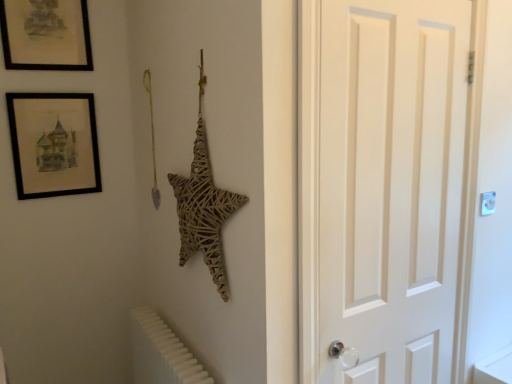
Question: Is black matte picture frame at upper left, placed as the second picture frame when sorted from top to bottom, facing away from white plastic light switch at upper right?

Choices:
 (A) no
 (B) yes

Answer: (A)

Question: Is black matte picture frame at upper left, placed as the second picture frame when sorted from top to bottom, in front of white plastic light switch at upper right?

Choices:
 (A) no
 (B) yes

Answer: (A)

Question: Is black matte picture frame at upper left, placed as the second picture frame when sorted from top to bottom, directly adjacent to white plastic light switch at upper right?

Choices:
 (A) no
 (B) yes

Answer: (A)

Question: Can we say black matte picture frame at upper left, placed as the second picture frame when sorted from top to bottom, lies outside white plastic light switch at upper right?

Choices:
 (A) no
 (B) yes

Answer: (B)

Question: Does black matte picture frame at upper left, positioned as the 1th picture frame in bottom-to-top order, have a greater width compared to white plastic light switch at upper right?

Choices:
 (A) yes
 (B) no

Answer: (A)

Question: Is black matte picture frame at upper left, placed as the second picture frame when sorted from top to bottom, wider or thinner than white plastic radiator at lower left?

Choices:
 (A) thin
 (B) wide

Answer: (A)

Question: Is point (90, 139) positioned closer to the camera than point (175, 352)?

Choices:
 (A) closer
 (B) farther

Answer: (B)

Question: Is black matte picture frame at upper left, placed as the second picture frame when sorted from top to bottom, bigger or smaller than white plastic radiator at lower left?

Choices:
 (A) small
 (B) big

Answer: (A)

Question: From the image's perspective, is black matte picture frame at upper left, positioned as the 1th picture frame in bottom-to-top order, located above or below white plastic radiator at lower left?

Choices:
 (A) above
 (B) below

Answer: (A)

Question: Is point (56, 148) positioned closer to the camera than point (414, 268)?

Choices:
 (A) farther
 (B) closer

Answer: (A)

Question: In the image, is black matte picture frame at upper left, positioned as the 1th picture frame in bottom-to-top order, on the left side or the right side of white wooden door at right?

Choices:
 (A) right
 (B) left

Answer: (B)

Question: From the image's perspective, is black matte picture frame at upper left, positioned as the 1th picture frame in bottom-to-top order, located above or below white wooden door at right?

Choices:
 (A) above
 (B) below

Answer: (A)

Question: From a real-world perspective, is black matte picture frame at upper left, positioned as the 1th picture frame in bottom-to-top order, above or below white wooden door at right?

Choices:
 (A) above
 (B) below

Answer: (A)

Question: Considering the positions of white plastic radiator at lower left and black matte picture frame at upper left, the 2th picture frame from the bottom, in the image, is white plastic radiator at lower left taller or shorter than black matte picture frame at upper left, the 2th picture frame from the bottom,?

Choices:
 (A) tall
 (B) short

Answer: (A)

Question: Visually, is white plastic radiator at lower left positioned to the left or to the right of black matte picture frame at upper left, the 1th picture frame when ordered from top to bottom?

Choices:
 (A) left
 (B) right

Answer: (B)